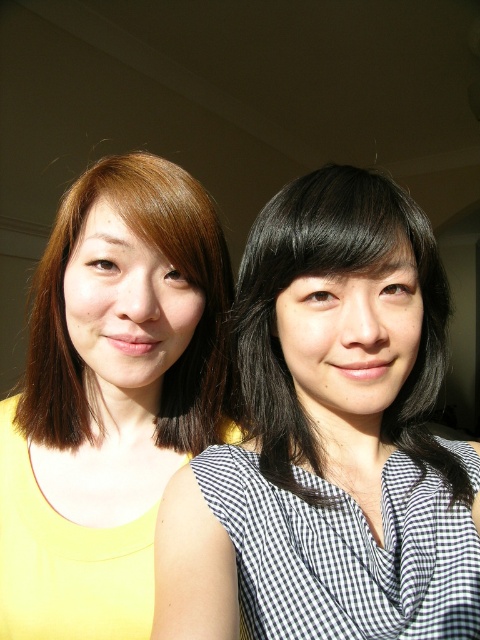
Is point (255, 355) closer to camera compared to point (131, 348)?

Yes, it is.

Does black checkered blouse at center have a larger size compared to yellow matte tank top at left?

Indeed, black checkered blouse at center has a larger size compared to yellow matte tank top at left.

The height and width of the screenshot is (640, 480). Describe the element at coordinates (330, 438) in the screenshot. I see `black checkered blouse at center` at that location.

Where is `black checkered blouse at center`? The height and width of the screenshot is (640, 480). black checkered blouse at center is located at coordinates (330, 438).